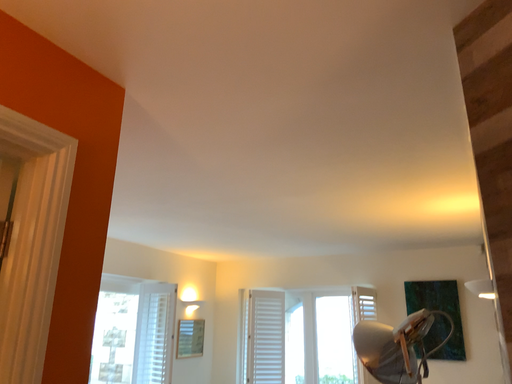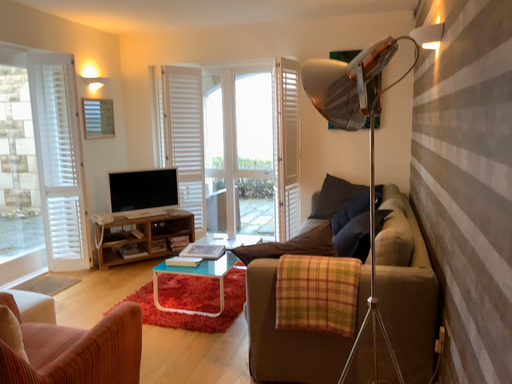
Question: Which way did the camera rotate in the video?

Choices:
 (A) rotated downward
 (B) rotated upward

Answer: (A)